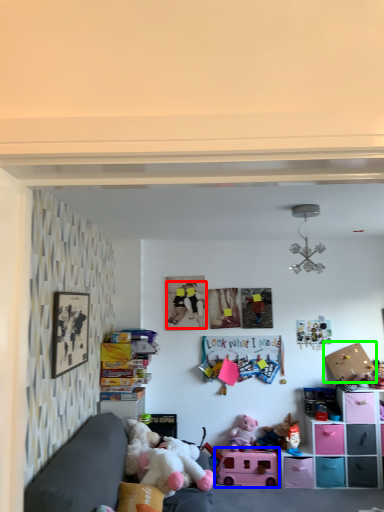
Question: Estimate the real-world distances between objects in this image. Which object is farther from person (highlighted by a red box), toy (highlighted by a blue box) or cardboard box (highlighted by a green box)?

Choices:
 (A) toy
 (B) cardboard box

Answer: (B)